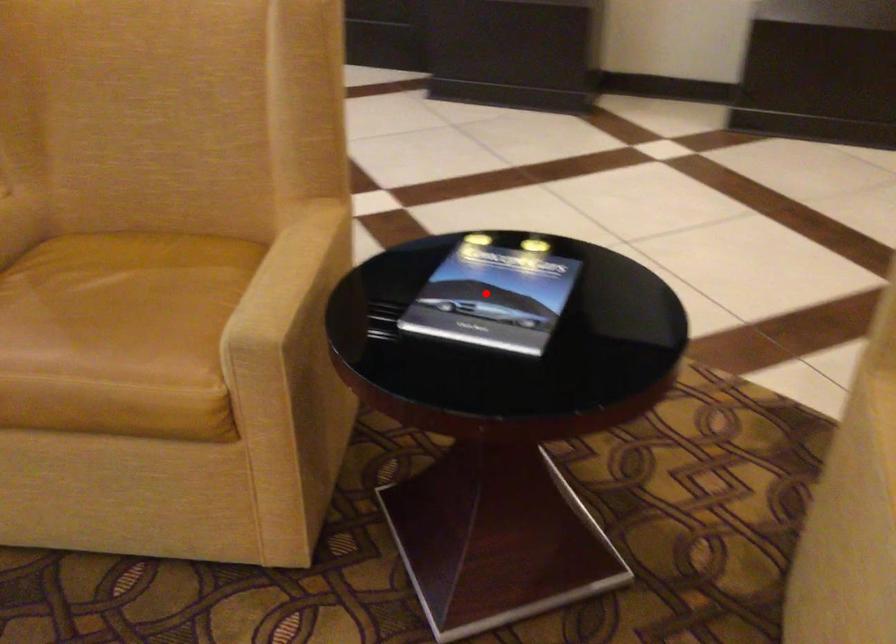
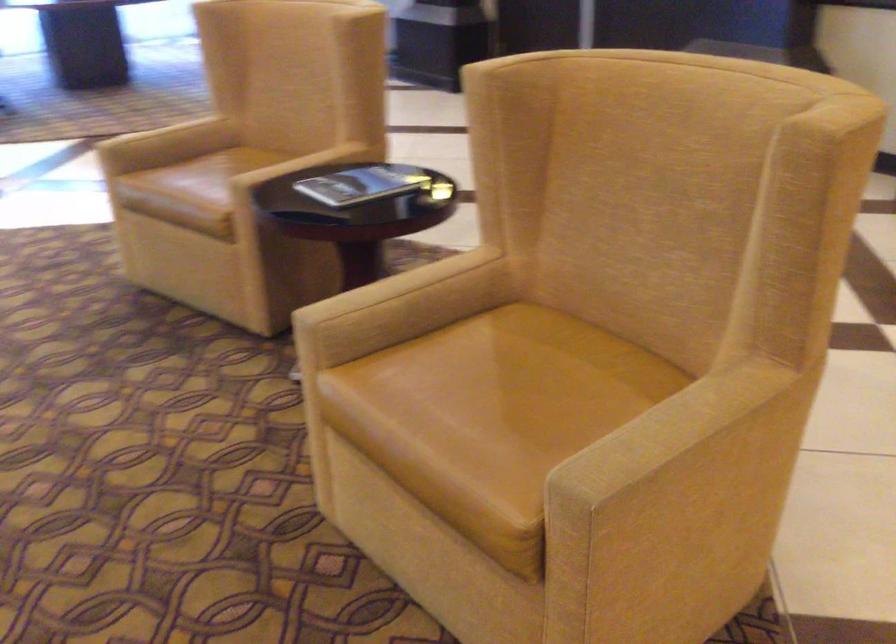
Question: I am providing you with two images of the same scene from different viewpoints. A red point is shown in image1. For the corresponding object point in image2, is it positioned nearer or farther from the camera?

Choices:
 (A) Nearer
 (B) Farther

Answer: (B)